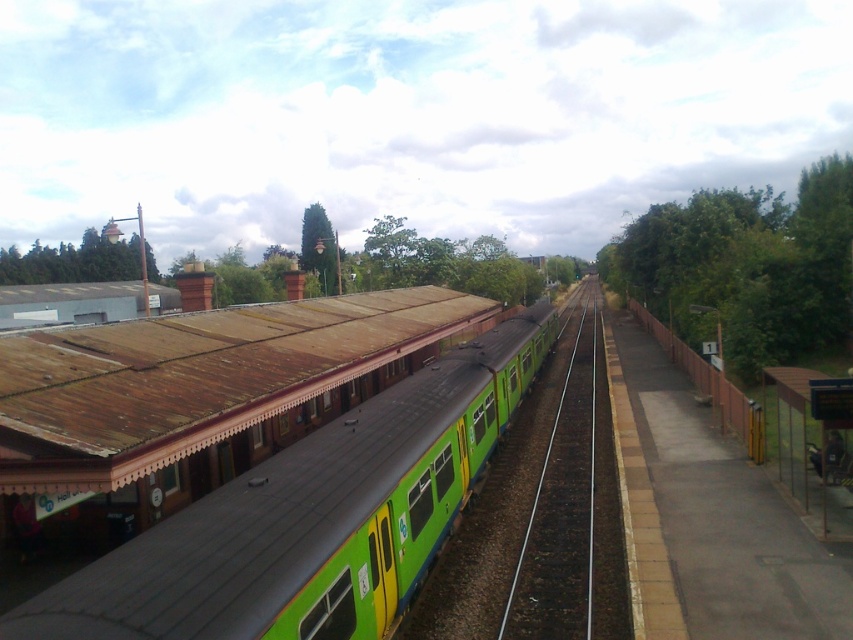
Question: Can you confirm if green matte train at center is positioned above green rubber train track at center?

Choices:
 (A) yes
 (B) no

Answer: (A)

Question: Considering the relative positions of green matte train at center and green rubber train track at center in the image provided, where is green matte train at center located with respect to green rubber train track at center?

Choices:
 (A) below
 (B) above

Answer: (B)

Question: Which point appears farthest from the camera in this image?

Choices:
 (A) (88, 634)
 (B) (518, 557)

Answer: (B)

Question: Does green matte train at center have a smaller size compared to green rubber train track at center?

Choices:
 (A) yes
 (B) no

Answer: (B)

Question: Which point is closer to the camera?

Choices:
 (A) green rubber train track at center
 (B) green matte train at center

Answer: (B)